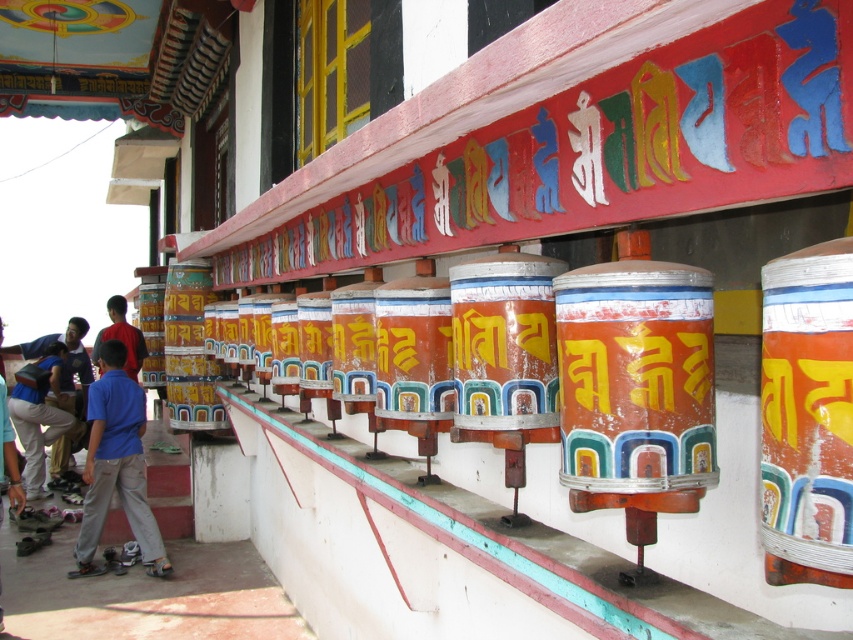
Question: Among these objects, which one is nearest to the camera?

Choices:
 (A) blue fabric shirt at lower left
 (B) blue shirt at lower left

Answer: (A)

Question: Which point is farther from the camera taking this photo?

Choices:
 (A) (19, 404)
 (B) (120, 312)

Answer: (B)

Question: Can you confirm if blue fabric shirt at lower left is positioned to the left of blue denim jeans at lower left?

Choices:
 (A) no
 (B) yes

Answer: (A)

Question: Does blue fabric shirt at lower left lie in front of blue denim jeans at lower left?

Choices:
 (A) yes
 (B) no

Answer: (A)

Question: In this image, where is blue denim jeans at lower left located relative to blue shirt at lower left?

Choices:
 (A) above
 (B) below

Answer: (B)

Question: Which object appears closest to the camera in this image?

Choices:
 (A) blue shirt at lower left
 (B) blue fabric shirt at lower left

Answer: (B)